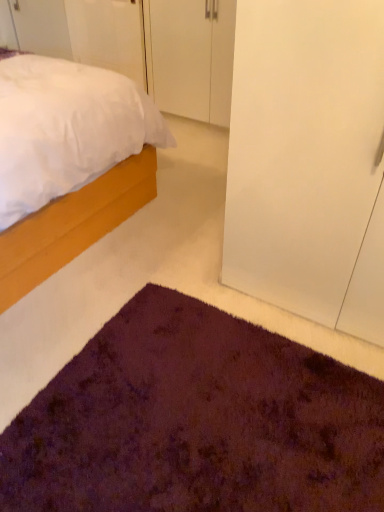
Question: Is white matte door at upper left, which is the 2th door in right-to-left order, at the right side of purple shaggy rug at lower center?

Choices:
 (A) no
 (B) yes

Answer: (A)

Question: Is purple shaggy rug at lower center at the back of white matte door at upper left, which is the 2th door in right-to-left order?

Choices:
 (A) no
 (B) yes

Answer: (A)

Question: Considering the relative sizes of white matte door at upper left, the 1th door from the left, and purple shaggy rug at lower center in the image provided, is white matte door at upper left, the 1th door from the left, thinner than purple shaggy rug at lower center?

Choices:
 (A) yes
 (B) no

Answer: (A)

Question: Is white matte door at upper left, the 1th door from the left, positioned beyond the bounds of purple shaggy rug at lower center?

Choices:
 (A) no
 (B) yes

Answer: (B)

Question: Can you confirm if white matte door at upper left, the 1th door from the left, is shorter than purple shaggy rug at lower center?

Choices:
 (A) no
 (B) yes

Answer: (A)

Question: Considering the relative positions of white matte door at upper left, which is the 2th door in right-to-left order, and purple shaggy rug at lower center in the image provided, is white matte door at upper left, which is the 2th door in right-to-left order, in front of purple shaggy rug at lower center?

Choices:
 (A) no
 (B) yes

Answer: (A)

Question: Considering the relative positions of transparent glass door at right and white matte door at upper left, which is the 2th door in right-to-left order, in the image provided, is transparent glass door at right to the right of white matte door at upper left, which is the 2th door in right-to-left order, from the viewer's perspective?

Choices:
 (A) yes
 (B) no

Answer: (A)

Question: Can we say transparent glass door at right lies outside white matte door at upper left, which is the 2th door in right-to-left order?

Choices:
 (A) yes
 (B) no

Answer: (A)

Question: From the image's perspective, does transparent glass door at right appear lower than white matte door at upper left, which is the 2th door in right-to-left order?

Choices:
 (A) no
 (B) yes

Answer: (B)

Question: Is transparent glass door at right wider than white matte door at upper left, the 1th door from the left?

Choices:
 (A) no
 (B) yes

Answer: (B)

Question: Is transparent glass door at right positioned behind white matte door at upper left, the 1th door from the left?

Choices:
 (A) yes
 (B) no

Answer: (B)

Question: Does transparent glass door at right have a larger size compared to white matte door at upper left, the 1th door from the left?

Choices:
 (A) no
 (B) yes

Answer: (B)

Question: Considering the relative sizes of transparent glass door at right and purple shaggy rug at lower center in the image provided, is transparent glass door at right shorter than purple shaggy rug at lower center?

Choices:
 (A) yes
 (B) no

Answer: (B)